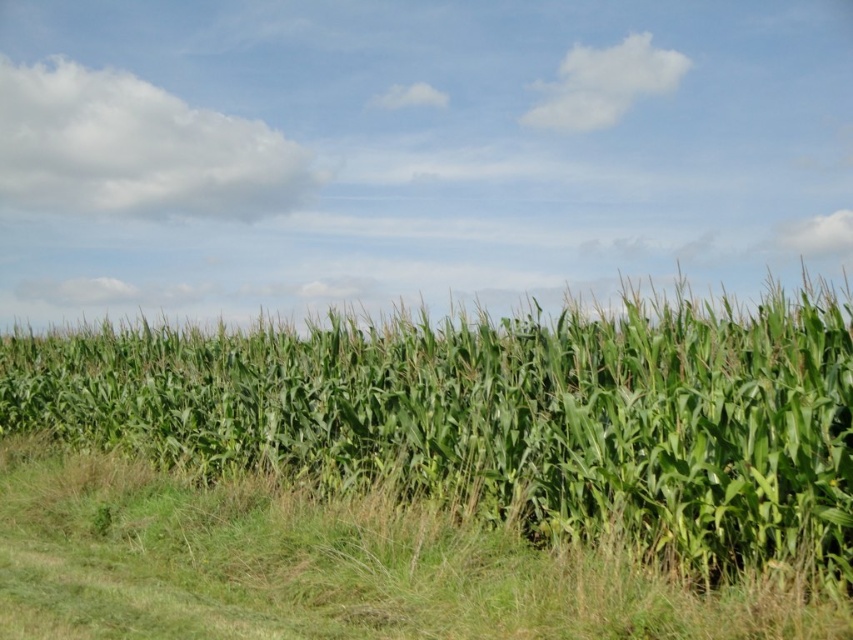
From the picture: You are standing in the cornfield and looking towards the green leafy corn at center. Which direction should you look to see the green grass at lower center?

The green grass at lower center is located below the green leafy corn at center, so you should look downward to see it.

You are standing in the middle of a cornfield and see the green leafy corn at center. If you walk straight ahead, will you eventually see the sky?

Yes, because the green leafy corn at center is located at point (502, 417), which is in the central area of the field, so walking straight ahead would lead towards the open space where the sky is visible in the background.